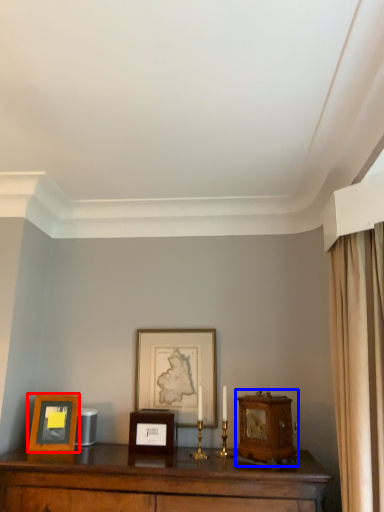
Question: Which object appears farthest to the camera in this image, picture frame (highlighted by a red box) or alarm clock (highlighted by a blue box)?

Choices:
 (A) picture frame
 (B) alarm clock

Answer: (A)